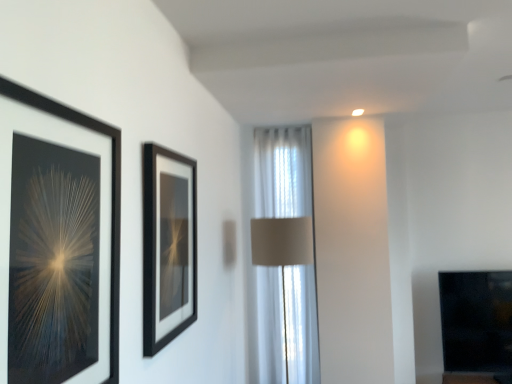
Question: From their relative heights in the image, would you say black glass fireplace at lower right is taller or shorter than black matte picture frame at left, marked as the second picture frame in a back-to-front arrangement?

Choices:
 (A) short
 (B) tall

Answer: (B)

Question: From the image's perspective, is black glass fireplace at lower right located above or below black matte picture frame at left, placed as the first picture frame when sorted from front to back?

Choices:
 (A) above
 (B) below

Answer: (B)

Question: Considering the real-world distances, which object is closest to the black glass fireplace at lower right?

Choices:
 (A) black matte picture frame at left, the 1th picture frame positioned from the left
 (B) black matte picture frame at center, the 2th picture frame in the front-to-back sequence
 (C) white sheer curtain at center

Answer: (C)

Question: Estimate the real-world distances between objects in this image. Which object is farther from the white sheer curtain at center?

Choices:
 (A) black matte picture frame at center, placed as the first picture frame when sorted from back to front
 (B) black matte picture frame at left, the 1th picture frame positioned from the left
 (C) black glass fireplace at lower right

Answer: (B)